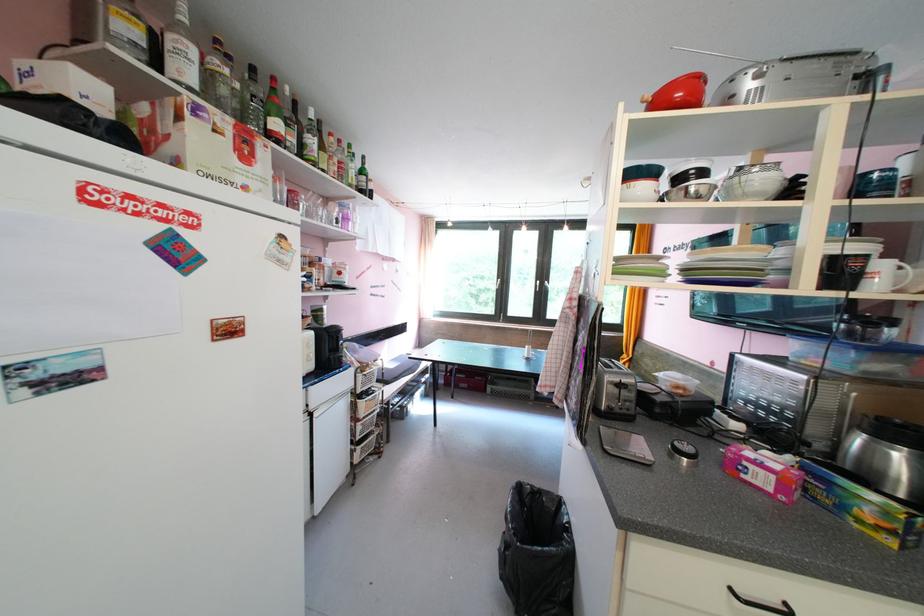
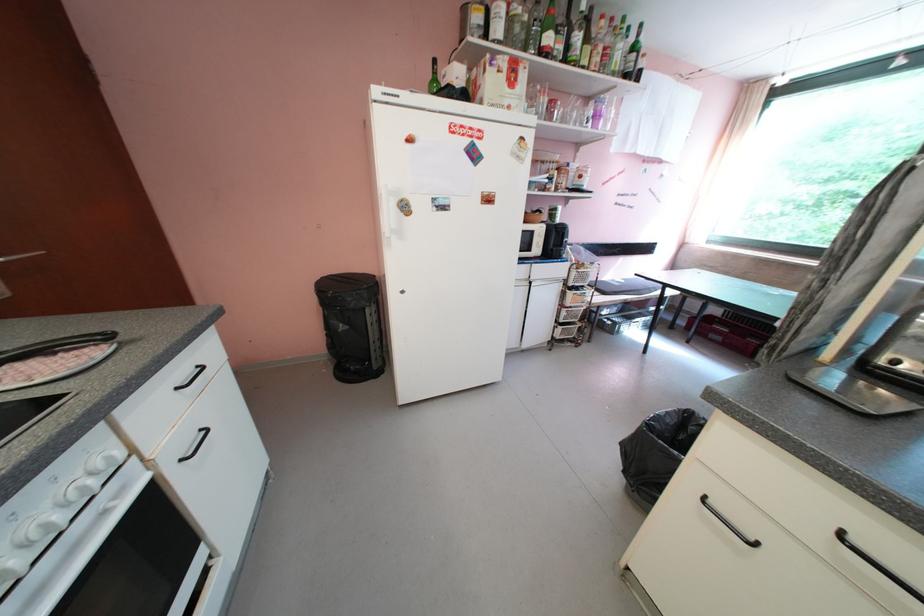
Find the pixel in the second image that matches point 371,369 in the first image.

(588, 268)